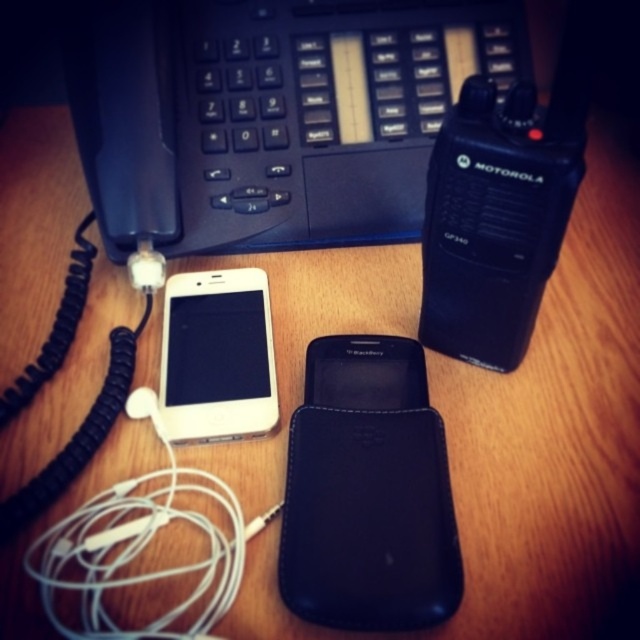
Question: Based on their relative distances, which object is farther from the white glossy ipod at center?

Choices:
 (A) black matte/blackberry at center
 (B) black plastic keyboard at upper center

Answer: (B)

Question: Among these points, which one is farthest from the camera?

Choices:
 (A) (266, 17)
 (B) (230, 378)
 (C) (412, 372)

Answer: (A)

Question: Which object appears closest to the camera in this image?

Choices:
 (A) black matte/blackberry at center
 (B) white glossy ipod at center
 (C) black plastic keyboard at upper center

Answer: (A)

Question: Is black plastic keyboard at upper center thinner than black matte/blackberry at center?

Choices:
 (A) yes
 (B) no

Answer: (B)

Question: Does black plastic keyboard at upper center appear under black matte/blackberry at center?

Choices:
 (A) yes
 (B) no

Answer: (B)

Question: Is black plastic keyboard at upper center positioned before black matte/blackberry at center?

Choices:
 (A) yes
 (B) no

Answer: (B)